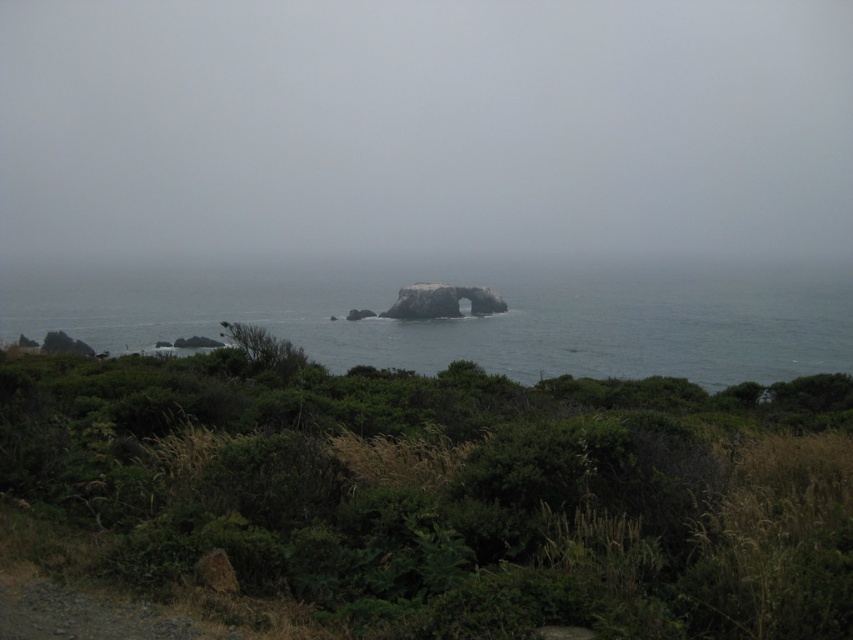
You are a hiker navigating a coastal path and notice the green leafy shrubs at center. Based on their position, can you determine if they are closer to you or further away compared to the large rock formation in the background?

The green leafy shrubs at center are located at point (451, 490), which places them in the foreground of the image, closer to the viewer than the large rock formation in the background.

You are a hiker trying to cross the coastal area shown in the image. You need to navigate between the green leafy shrubs at center and the gray rock at center. Which object will require more space to maneuver around?

The gray rock at center requires more space to maneuver around because it occupies more space than the green leafy shrubs at center.